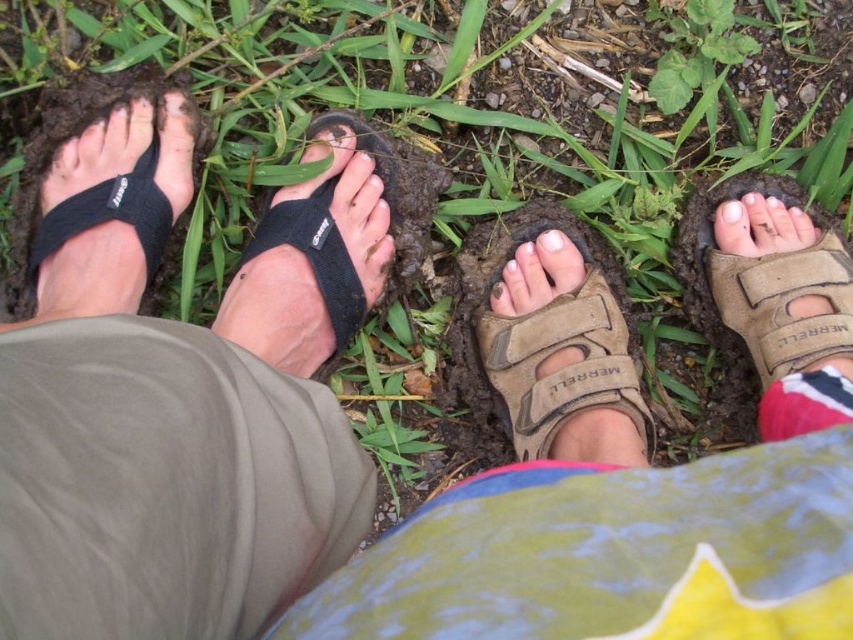
Is point (804, 356) closer to viewer compared to point (558, 234)?

Yes, point (804, 356) is in front of point (558, 234).

How distant is tan suede sandal at right from white matte nail at center?

A distance of 12.68 inches exists between tan suede sandal at right and white matte nail at center.

Which is in front, point (741, 284) or point (556, 234)?

Positioned in front is point (741, 284).

Find the location of `tan suede sandal at right`. tan suede sandal at right is located at coordinates (782, 292).

Does black fabric toe strap at left have a smaller size compared to white matte toe at center?

No.

Is black fabric toe strap at left in front of white matte toe at center?

Yes, it is in front of white matte toe at center.

Is point (171, 260) behind point (509, 259)?

No.

Image resolution: width=853 pixels, height=640 pixels. I want to click on black fabric toe strap at left, so click(x=77, y=134).

Is black fabric sandal at lower left smaller than matte black toe at center?

Actually, black fabric sandal at lower left might be larger than matte black toe at center.

Who is more distant from viewer, (291,262) or (305,148)?

The point (305,148) is behind.

This screenshot has height=640, width=853. I want to click on black fabric sandal at lower left, so pos(312,257).

Where is `black fabric sandal at lower left`? This screenshot has width=853, height=640. black fabric sandal at lower left is located at coordinates (312, 257).